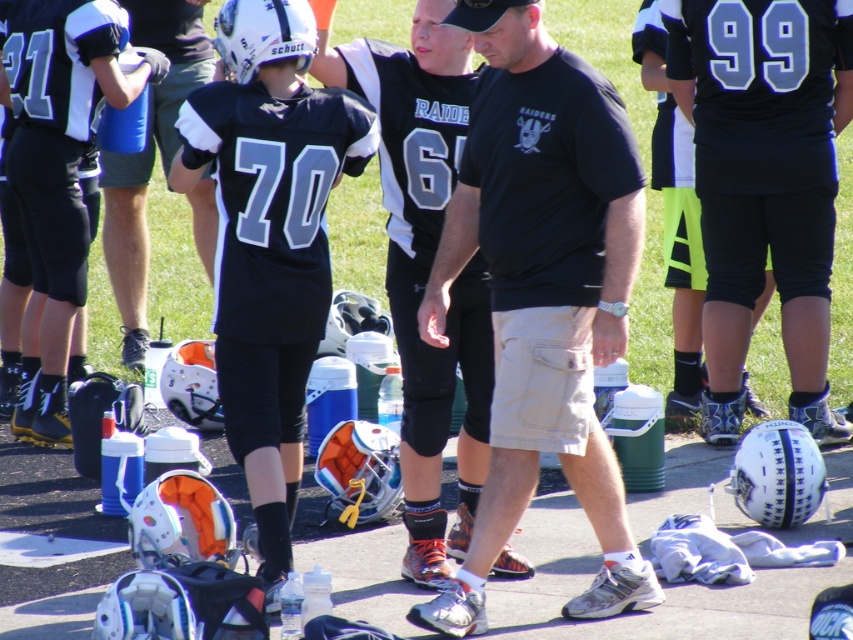
Question: Is the position of black cotton t-shirt at center more distant than that of matte black helmet at center?

Choices:
 (A) yes
 (B) no

Answer: (B)

Question: Among these objects, which one is nearest to the camera?

Choices:
 (A) black cotton t-shirt at center
 (B) matte black helmet at center

Answer: (A)

Question: Is black cotton t-shirt at center wider than matte black helmet at center?

Choices:
 (A) yes
 (B) no

Answer: (A)

Question: Does black cotton t-shirt at center have a lesser width compared to matte black helmet at center?

Choices:
 (A) yes
 (B) no

Answer: (B)

Question: Which object is closer to the camera taking this photo?

Choices:
 (A) black cotton t-shirt at center
 (B) matte black helmet at center

Answer: (A)